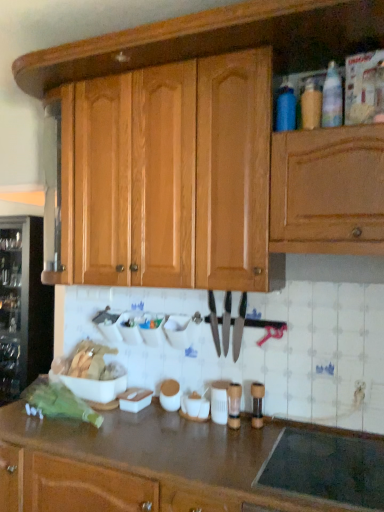
Question: Looking at the image, does wooden cabinet at upper center seem bigger or smaller compared to blue matte bottle at upper right, the first bottle positioned from the left?

Choices:
 (A) big
 (B) small

Answer: (A)

Question: Considering their positions, is wooden cabinet at upper center located in front of or behind blue matte bottle at upper right, the first bottle positioned from the left?

Choices:
 (A) front
 (B) behind

Answer: (A)

Question: Which object is positioned closest to the wooden cabinet at upper center?

Choices:
 (A) translucent plastic bottle at upper right, the 3th bottle in the left-to-right sequence
 (B) shiny silver knife at center
 (C) brown laminate countertop at lower center
 (D) blue matte bottle at upper right, the first bottle positioned from the left
 (E) translucent plastic bottle at upper right, the second bottle viewed from the right

Answer: (D)

Question: Estimate the real-world distances between objects in this image. Which object is farther from the black metallic knife at center, the 2th knife in the left-to-right sequence?

Choices:
 (A) wooden cabinet at upper center
 (B) shiny silver knife at center, arranged as the first knife when viewed from the left
 (C) translucent plastic bottle at upper right, the second bottle viewed from the right
 (D) transparent glass wine cooler at left
 (E) black glass stovetop at lower right

Answer: (D)